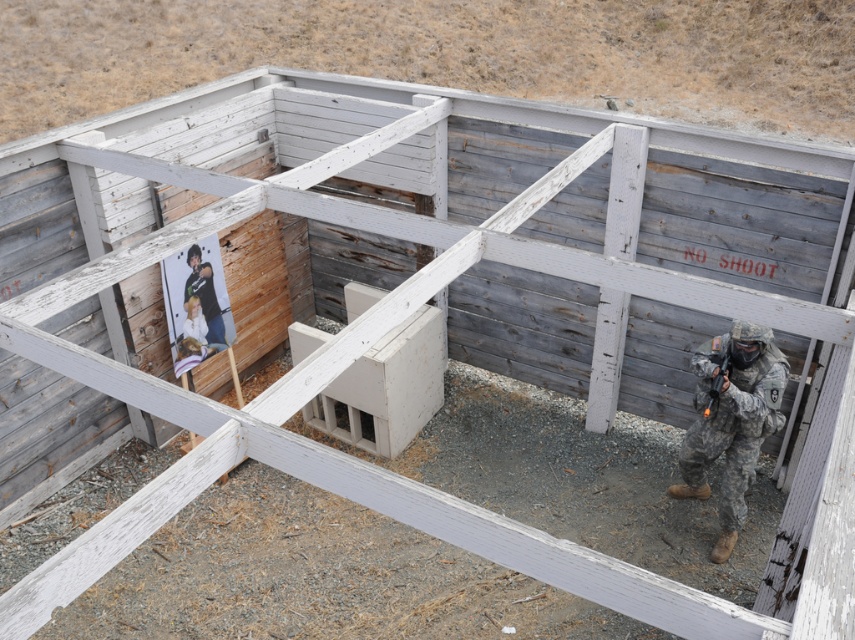
Question: Which of the following is the closest to the observer?

Choices:
 (A) camouflage uniform at center
 (B) matte black rifle at right
 (C) camouflage fabric soldier at right

Answer: (C)

Question: Can you confirm if camouflage fabric soldier at right is positioned to the left of camouflage uniform at center?

Choices:
 (A) no
 (B) yes

Answer: (A)

Question: Does camouflage fabric soldier at right appear over matte black rifle at right?

Choices:
 (A) no
 (B) yes

Answer: (A)

Question: Which is nearer to the camouflage uniform at center?

Choices:
 (A) matte black rifle at right
 (B) camouflage fabric soldier at right

Answer: (A)

Question: Which point is closer to the camera taking this photo?

Choices:
 (A) click(708, 400)
 (B) click(709, 408)

Answer: (B)

Question: Does camouflage fabric soldier at right appear on the left side of camouflage uniform at center?

Choices:
 (A) no
 (B) yes

Answer: (A)